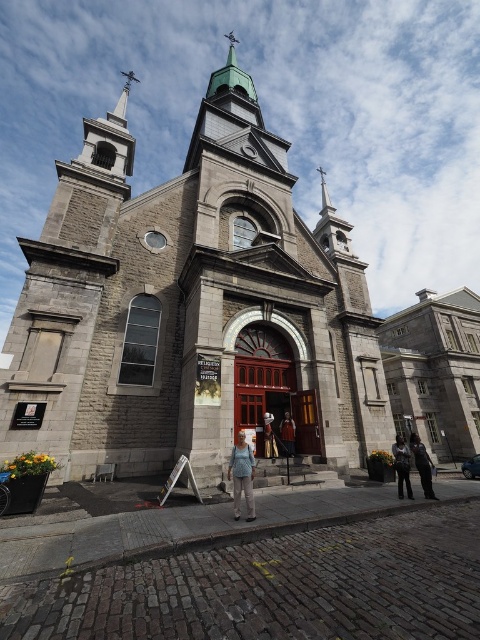
You are standing in front of the historic stone church and want to determine the spatial relationship between two points marked on the facade. Which point is closer to you, point at coordinate (289,442) or point at coordinate (273,449)?

Point at coordinate (289,442) is closer to you than point at coordinate (273,449) because it is further to the viewer according to the description.

You are standing at point A located at coordinates point A at [288,429]. You want to walk to point B, which is 10.87 meters away from point A. Can you estimate how far you need to walk to reach point B?

The distance between point A at [288,429] and point B is 10.87 meters, so you need to walk 10.87 meters to reach point B.